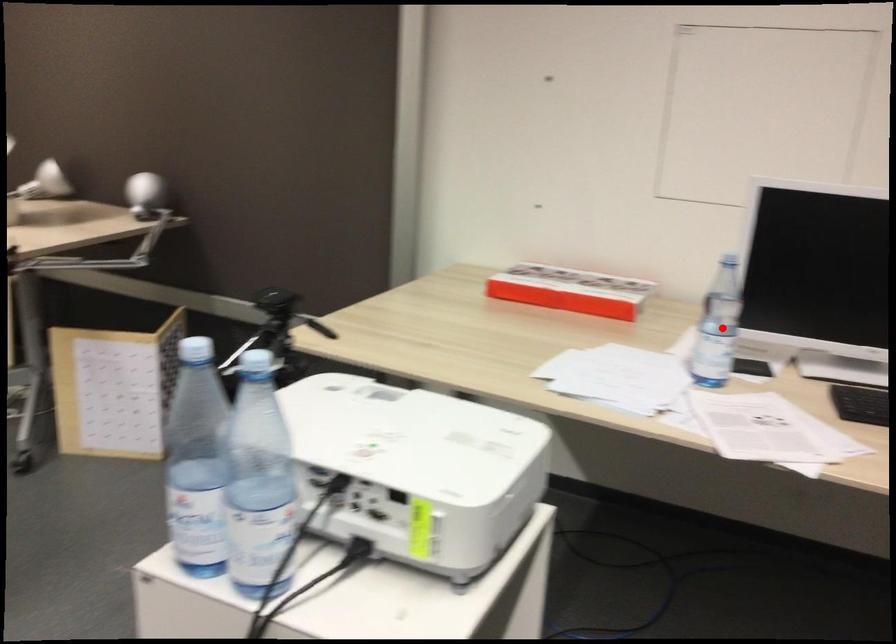
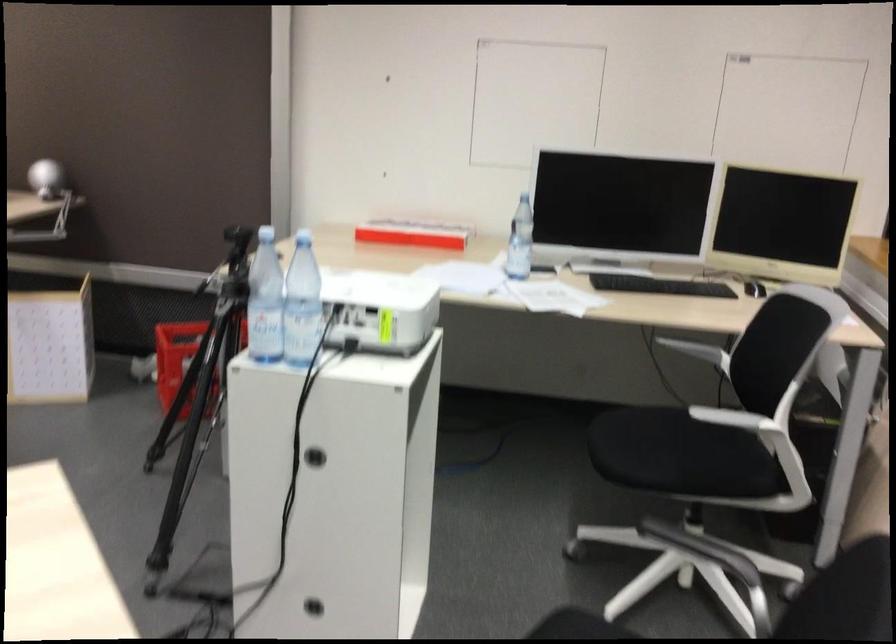
Locate, in the second image, the point that corresponds to the highlighted location in the first image.

(520, 241)